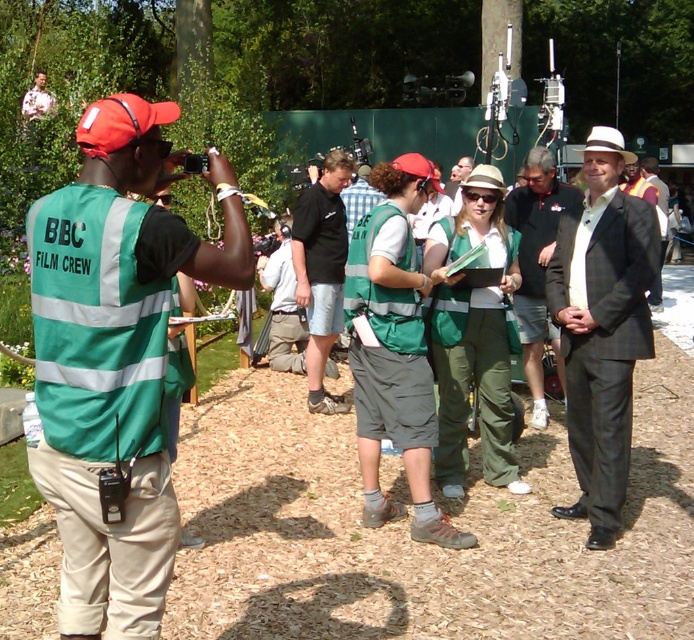
You are a crew member in the BBC film crew. You need to locate the green reflective vest at left and the matte black suit at right. From your perspective, which object is closer to the bottom of the image?

The green reflective vest at left is positioned under the matte black suit at right, so it is closer to the bottom of the image.